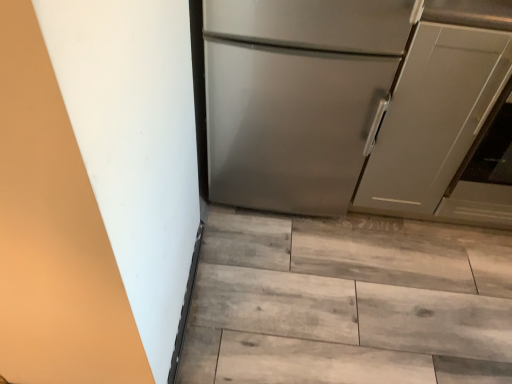
Question: Is wooden floor at lower center at the back of satin silver refrigerator at center?

Choices:
 (A) yes
 (B) no

Answer: (B)

Question: Does satin silver refrigerator at center have a lesser width compared to wooden floor at lower center?

Choices:
 (A) no
 (B) yes

Answer: (B)

Question: From a real-world perspective, is satin silver refrigerator at center physically above wooden floor at lower center?

Choices:
 (A) no
 (B) yes

Answer: (B)

Question: Does satin silver refrigerator at center lie behind wooden floor at lower center?

Choices:
 (A) no
 (B) yes

Answer: (A)

Question: From the image's perspective, is satin silver refrigerator at center over wooden floor at lower center?

Choices:
 (A) no
 (B) yes

Answer: (B)

Question: Can you confirm if satin silver refrigerator at center is wider than wooden floor at lower center?

Choices:
 (A) no
 (B) yes

Answer: (A)

Question: Considering the relative positions of satin silver refrigerator at center and matte gray cabinet at right in the image provided, is satin silver refrigerator at center behind matte gray cabinet at right?

Choices:
 (A) yes
 (B) no

Answer: (B)

Question: Would you say satin silver refrigerator at center is a long distance from matte gray cabinet at right?

Choices:
 (A) yes
 (B) no

Answer: (B)

Question: Is satin silver refrigerator at center smaller than matte gray cabinet at right?

Choices:
 (A) yes
 (B) no

Answer: (B)

Question: From a real-world perspective, is satin silver refrigerator at center below matte gray cabinet at right?

Choices:
 (A) no
 (B) yes

Answer: (A)

Question: From the image's perspective, would you say satin silver refrigerator at center is positioned over matte gray cabinet at right?

Choices:
 (A) no
 (B) yes

Answer: (B)

Question: Considering the relative positions of satin silver refrigerator at center and matte gray cabinet at right in the image provided, is satin silver refrigerator at center to the right of matte gray cabinet at right from the viewer's perspective?

Choices:
 (A) no
 (B) yes

Answer: (A)

Question: Is wooden floor at lower center taller than satin silver refrigerator at center?

Choices:
 (A) no
 (B) yes

Answer: (A)